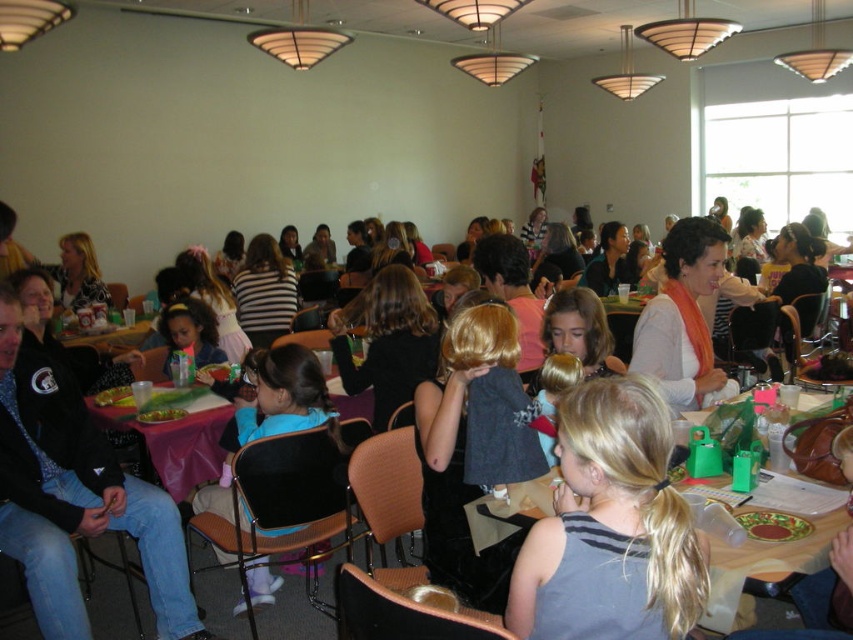
You are a guest at this party and notice both the matte black jacket at center and the matte plastic cup at center. Which object is positioned lower from the floor?

The matte black jacket at center is located below the matte plastic cup at center, so it is positioned lower from the floor.

You are at a party and want to place both the matte plastic cup at center and the green leafy salad at center on a small tray. The tray can only hold items that are no wider than 10 cm. Which item might not fit on the tray?

The matte plastic cup at center has a larger width than the green leafy salad at center, so the matte plastic cup at center might not fit on the tray if it exceeds the 10 cm limit.